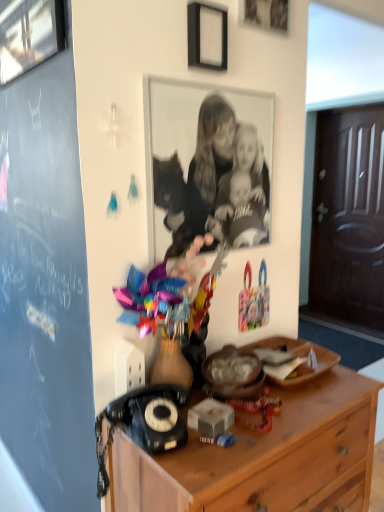
Question: Is wooden chest of drawers at lower right bigger than wooden plate at center?

Choices:
 (A) yes
 (B) no

Answer: (A)

Question: Is wooden chest of drawers at lower right taller than wooden plate at center?

Choices:
 (A) yes
 (B) no

Answer: (A)

Question: Considering the relative sizes of wooden chest of drawers at lower right and wooden plate at center in the image provided, is wooden chest of drawers at lower right smaller than wooden plate at center?

Choices:
 (A) yes
 (B) no

Answer: (B)

Question: Could you tell me if wooden chest of drawers at lower right is turned towards wooden plate at center?

Choices:
 (A) no
 (B) yes

Answer: (A)

Question: Can you confirm if wooden chest of drawers at lower right is thinner than wooden plate at center?

Choices:
 (A) yes
 (B) no

Answer: (B)

Question: Is point (104, 478) positioned closer to the camera than point (203, 64)?

Choices:
 (A) farther
 (B) closer

Answer: (A)

Question: Is black plastic rotary phone at lower left bigger or smaller than black matte picture frame at upper center, the 2th picture frame in the left-to-right sequence?

Choices:
 (A) small
 (B) big

Answer: (B)

Question: In terms of height, does black plastic rotary phone at lower left look taller or shorter compared to black matte picture frame at upper center, which is the second picture frame from right to left?

Choices:
 (A) short
 (B) tall

Answer: (B)

Question: Considering their positions, is black plastic rotary phone at lower left located in front of or behind black matte picture frame at upper center, the 2th picture frame in the left-to-right sequence?

Choices:
 (A) behind
 (B) front

Answer: (B)

Question: Considering their positions, is wooden picture frame at upper center, which appears as the third picture frame when viewed from the left, located in front of or behind wooden chest of drawers at lower right?

Choices:
 (A) behind
 (B) front

Answer: (A)

Question: Considering the positions of wooden picture frame at upper center, which appears as the third picture frame when viewed from the left, and wooden chest of drawers at lower right in the image, is wooden picture frame at upper center, which appears as the third picture frame when viewed from the left, taller or shorter than wooden chest of drawers at lower right?

Choices:
 (A) short
 (B) tall

Answer: (A)

Question: Considering the positions of wooden picture frame at upper center, which appears as the third picture frame when viewed from the left, and wooden chest of drawers at lower right in the image, is wooden picture frame at upper center, which appears as the third picture frame when viewed from the left, bigger or smaller than wooden chest of drawers at lower right?

Choices:
 (A) big
 (B) small

Answer: (B)

Question: Considering the positions of point (274, 28) and point (173, 498), is point (274, 28) closer or farther from the camera than point (173, 498)?

Choices:
 (A) closer
 (B) farther

Answer: (B)

Question: Is wooden plate at center inside or outside of brushed metal picture frame at upper left, which ranks as the 1th picture frame in left-to-right order?

Choices:
 (A) inside
 (B) outside

Answer: (B)

Question: From a real-world perspective, is wooden plate at center positioned above or below brushed metal picture frame at upper left, which ranks as the 1th picture frame in left-to-right order?

Choices:
 (A) below
 (B) above

Answer: (A)